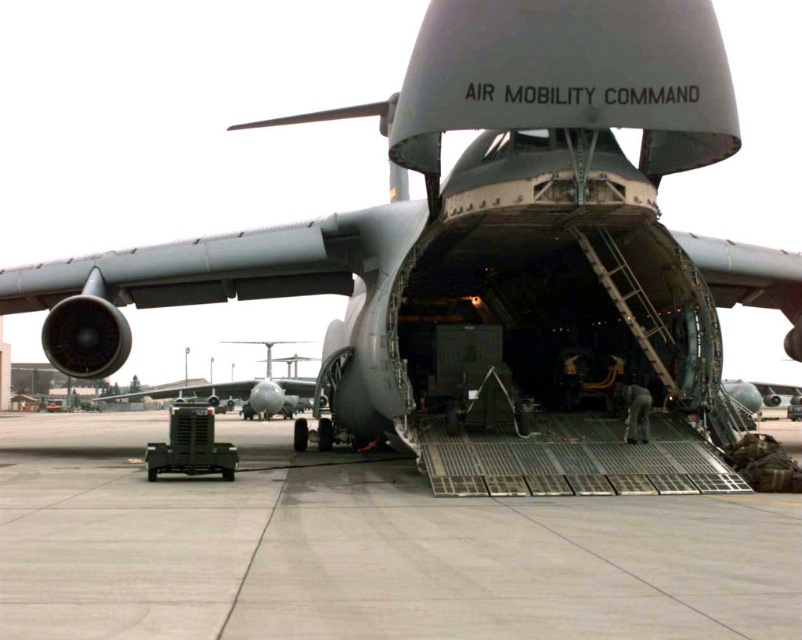
Does gray concrete tarmac at center have a larger size compared to metallic gray aircraft at center?

Incorrect, gray concrete tarmac at center is not larger than metallic gray aircraft at center.

Between point (286, 458) and point (237, 397), which one is positioned in front?

Point (286, 458) is in front.

This screenshot has height=640, width=802. Identify the location of gray concrete tarmac at center. (363, 548).